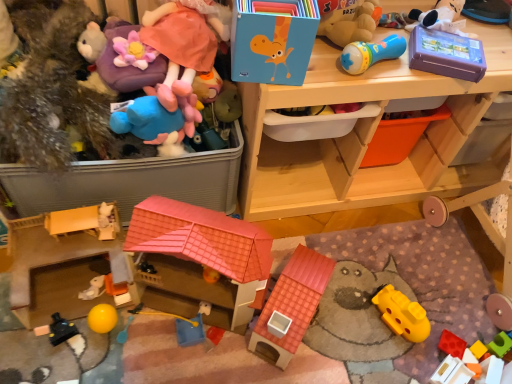
Where is `free space behind rubberized red block at lower right, the thirteenth toy viewed from the left`? This screenshot has height=384, width=512. free space behind rubberized red block at lower right, the thirteenth toy viewed from the left is located at coordinates pyautogui.click(x=440, y=291).